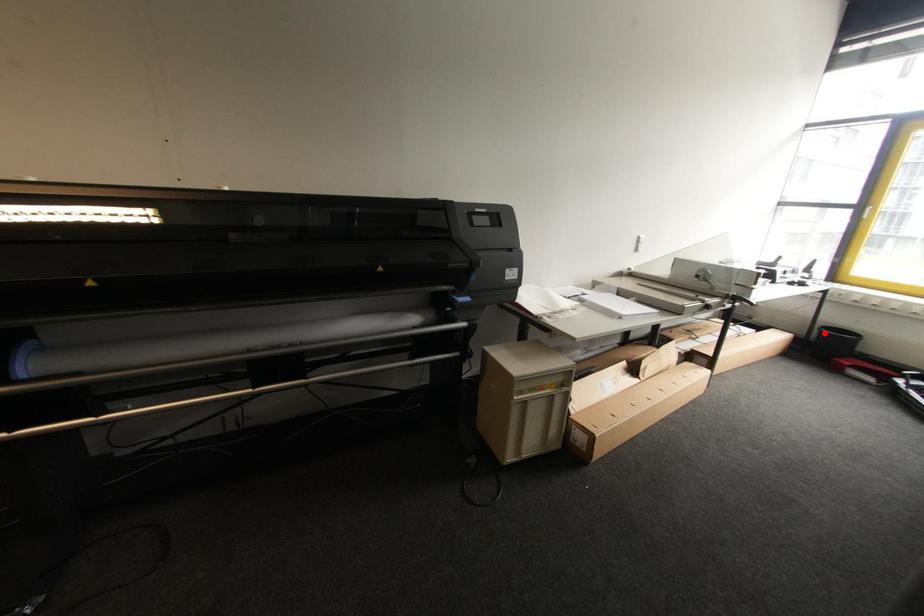
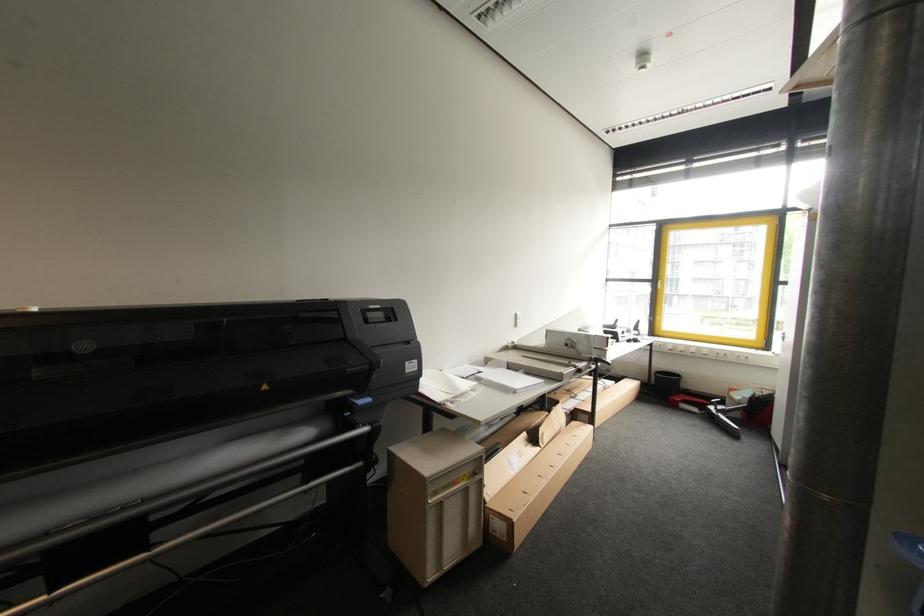
Question: I am providing you with two images of the same scene from different viewpoints. In image1, a red point is highlighted. Considering the same 3D point in image2, which of the following is correct?

Choices:
 (A) It is closer
 (B) It is farther

Answer: (A)